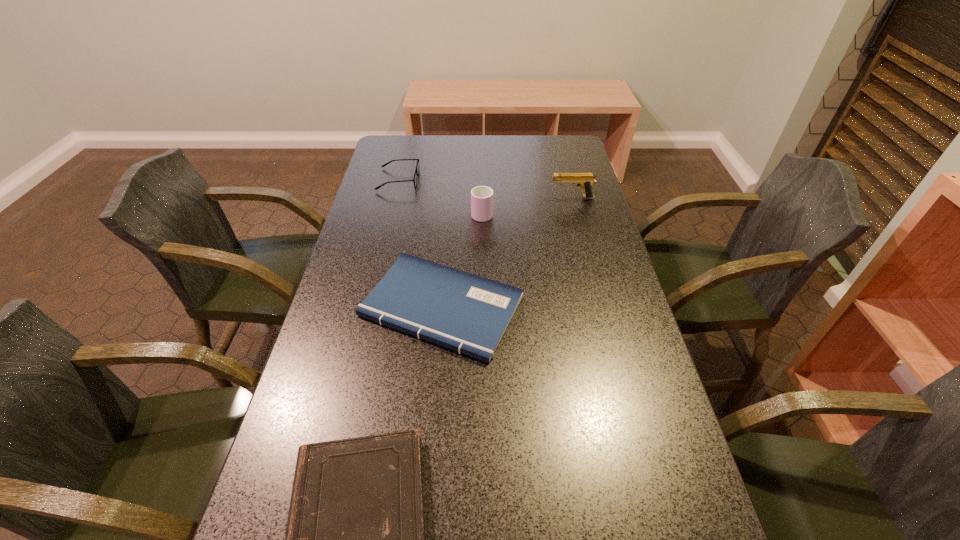
Where is `free space located with the handle on the side of the cup`? The width and height of the screenshot is (960, 540). free space located with the handle on the side of the cup is located at coordinates (482, 161).

Identify the location of vacant space situated 0.250m with the handle on the side of the cup. The image size is (960, 540). (482, 164).

Where is `vacant point located 0.240m on the front-facing side of the third tallest object`? This screenshot has height=540, width=960. vacant point located 0.240m on the front-facing side of the third tallest object is located at coordinates (488, 180).

Where is `vacant region located on the front of the fourth farthest object`? The image size is (960, 540). vacant region located on the front of the fourth farthest object is located at coordinates (435, 388).

The height and width of the screenshot is (540, 960). I want to click on spectacles located at the left edge, so click(416, 173).

Find the location of a particular element. paperback book located in the left edge section of the desktop is located at coordinates (461, 311).

This screenshot has height=540, width=960. What are the coordinates of `object that is at the right edge` in the screenshot? It's located at (585, 181).

Identify the location of vacant space at the far edge of the desktop. (489, 159).

Identify the location of vacant space at the left edge of the desktop. (371, 208).

Find the location of `free space at the right edge`. free space at the right edge is located at coordinates (646, 432).